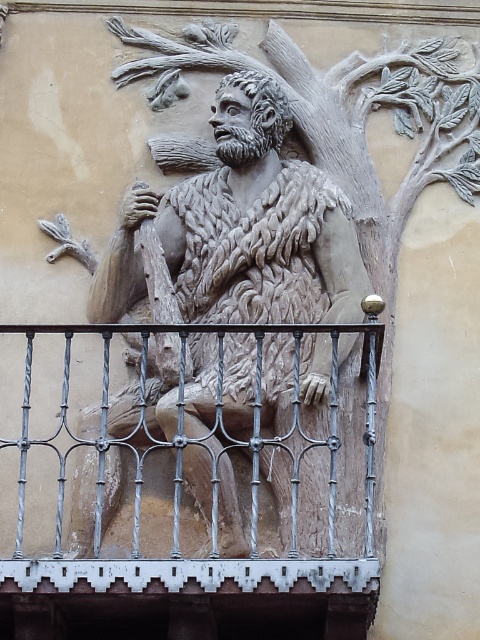
You are an architect examining the stone relief sculpture. The building facade has a grid system marked at intervals of 0.1 units. Where is the carved stone figure at center positioned relative to the grid points? Please provide the nearest grid point coordinates.

The carved stone figure at center is located at point coordinates approximately (x=252, y=280). The nearest grid points would be 0.4 and 0.5 since the grid intervals are at 0.1 units. Therefore, the closest grid point is (x=240, y=256).

You are an architect assessing the building facade. You need to determine if the carved stone figure at center can be moved to a different location without affecting the structural integrity of the polished metal railing at center. What should you consider based on their sizes?

The carved stone figure at center is larger than the polished metal railing at center. Moving the larger figure might require more space and could potentially impact the railing if they are positioned too closely.

In the scene shown: You are an art conservator examining the stone relief sculpture. You notice two points on the sculpture at coordinates point (311, 454) and point (131, 598). Which point is closer to your viewpoint?

Point (311, 454) is further to the viewer than point (131, 598), so point (311, 454) is closer to your viewpoint.